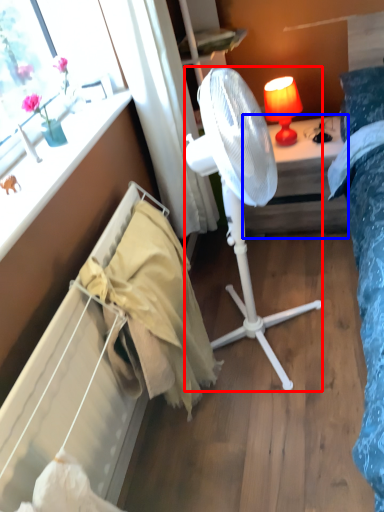
Question: Which object is closer to the camera taking this photo, mechanical fan (highlighted by a red box) or desk (highlighted by a blue box)?

Choices:
 (A) mechanical fan
 (B) desk

Answer: (A)